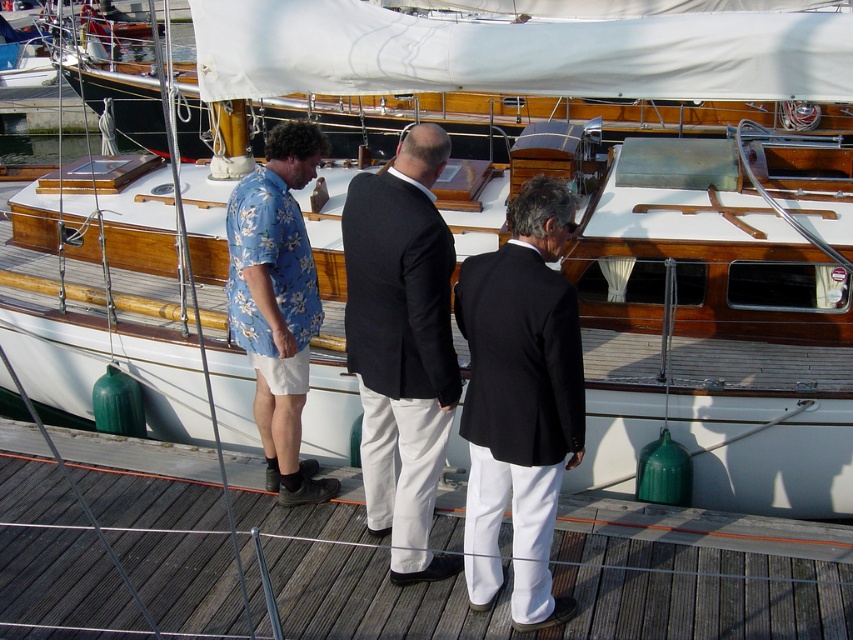
Question: Which point is farther to the camera?

Choices:
 (A) (300, 269)
 (B) (410, 385)
 (C) (24, 468)
 (D) (424, 125)

Answer: (C)

Question: Does matte black suit at center appear over black matte suit at center?

Choices:
 (A) yes
 (B) no

Answer: (A)

Question: Does matte black suit at center appear over black wool suit at center?

Choices:
 (A) yes
 (B) no

Answer: (A)

Question: Which object is the closest to the blue floral shirt at left?

Choices:
 (A) matte black suit at center
 (B) black wool suit at center

Answer: (A)

Question: Is the position of wooden at center less distant than that of black matte suit at center?

Choices:
 (A) yes
 (B) no

Answer: (B)

Question: Which object appears closest to the camera in this image?

Choices:
 (A) black wool suit at center
 (B) matte black suit at center
 (C) black matte suit at center

Answer: (C)